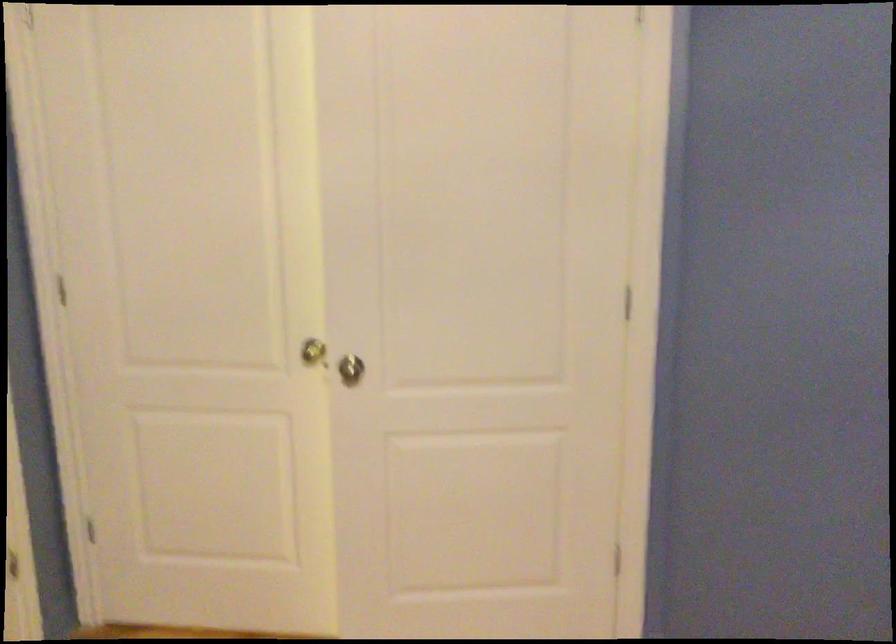
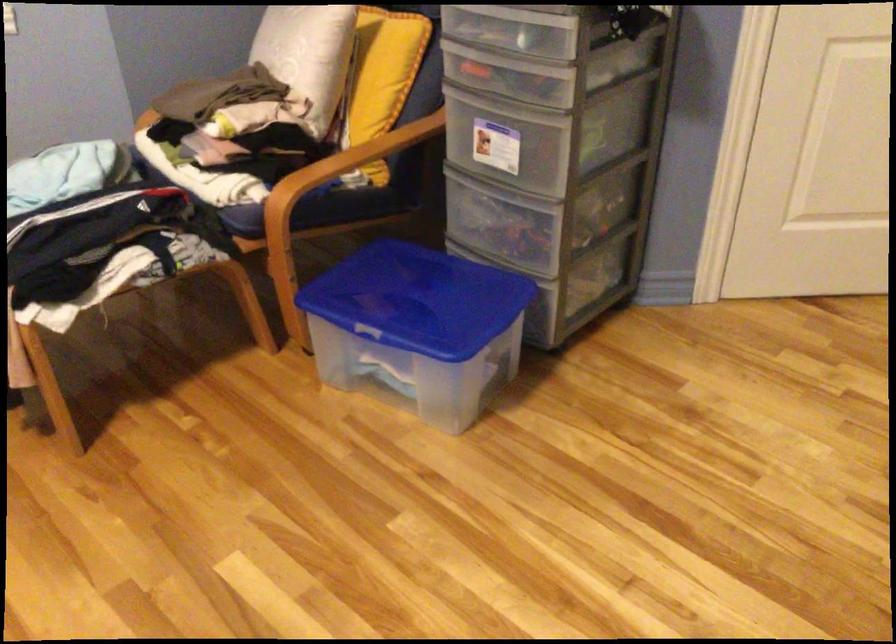
How did the camera likely rotate?

The camera's rotation is toward left-down.